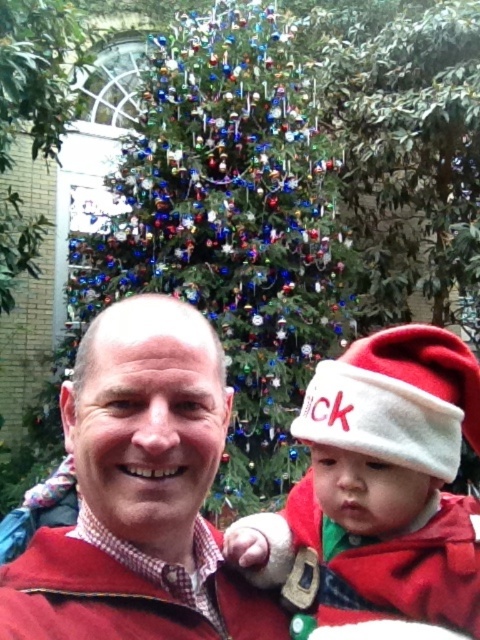
Question: In this image, where is shiny multicolored ornaments at center located relative to maroon fleece jacket at center?

Choices:
 (A) right
 (B) left

Answer: (B)

Question: Does shiny multicolored ornaments at center appear on the right side of white felt santa hat at right?

Choices:
 (A) no
 (B) yes

Answer: (A)

Question: Which object is the closest to the white felt santa hat at right?

Choices:
 (A) shiny multicolored ornaments at center
 (B) matte red sweater at center
 (C) maroon fleece jacket at center

Answer: (B)

Question: Can you confirm if matte red sweater at center is positioned to the right of white felt santa hat at right?

Choices:
 (A) no
 (B) yes

Answer: (A)

Question: Which point is closer to the camera?

Choices:
 (A) shiny multicolored ornaments at center
 (B) white felt santa hat at right
 (C) matte red sweater at center
 (D) maroon fleece jacket at center

Answer: (D)

Question: Considering the real-world distances, which object is farthest from the shiny multicolored ornaments at center?

Choices:
 (A) white fleece hat at center
 (B) matte red sweater at center
 (C) maroon fleece jacket at center

Answer: (A)